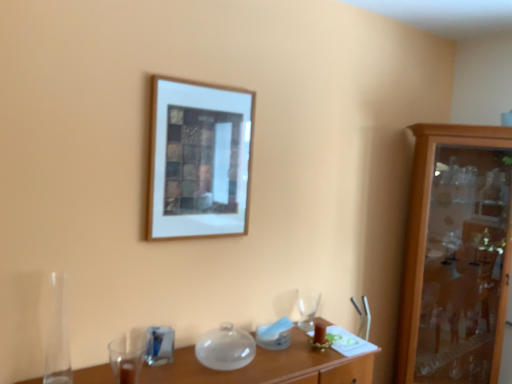
Where is `free location to the right of blue glass at lower left, the 1th tableware in the front-to-back sequence`? This screenshot has width=512, height=384. free location to the right of blue glass at lower left, the 1th tableware in the front-to-back sequence is located at coordinates pyautogui.click(x=192, y=362).